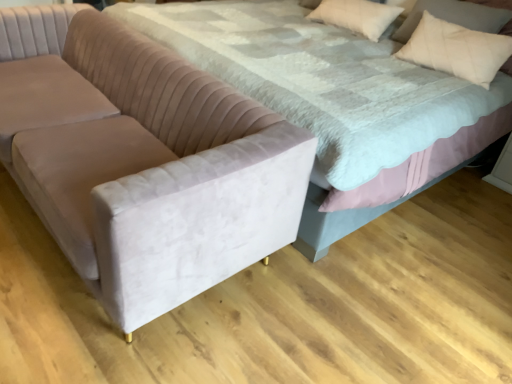
Find the location of a particular element. The width and height of the screenshot is (512, 384). empty space that is in between velvet couch at left and velvet bed at center is located at coordinates (247, 318).